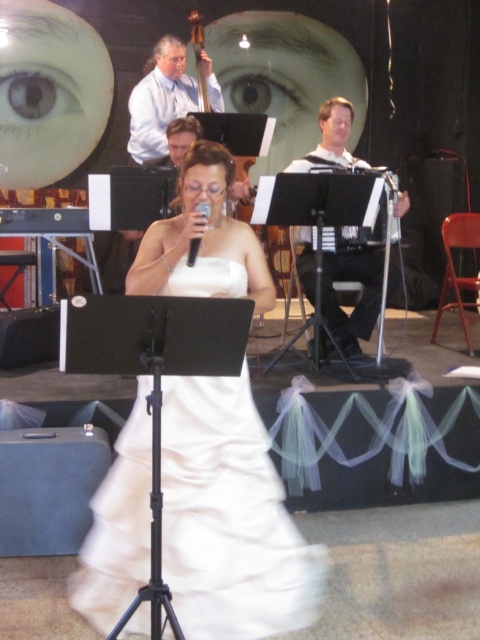
You are a photographer at the event and want to capture both the white fabric dress at center and the light blue shirt at upper center in a single shot. Given that your camera has a fixed focal length, which subject should you focus on to ensure both are in frame without cropping?

Since the white fabric dress at center occupies less space than the light blue shirt at upper center, you should focus on the light blue shirt at upper center to ensure both subjects fit within the frame.

You are a photographer positioned at the front of the stage. You need to capture a closeup shot of the singer while ensuring the white fabric dress at center is visible in the frame. Given that your camera has a focal length of 85mm, which is best suited for portraits, can you determine if the dress will be fully visible in the photo?

The white fabric dress at center is located at point [360,298], which is within the central area of the frame. Since the camera is set to 85mm focal length for portraits, the dress should be fully visible as it is centered and the focal length is appropriate for capturing details of the subject while keeping the dress in the frame.

You are standing at the center of the stage and want to move towards the point closest to the singer. Which point should you move towards, point (340, 104) or point (151, 147)?

Answer: Point (340, 104) is in front of point (151, 147), so you should move towards point (340, 104) as it is closer to the singer.